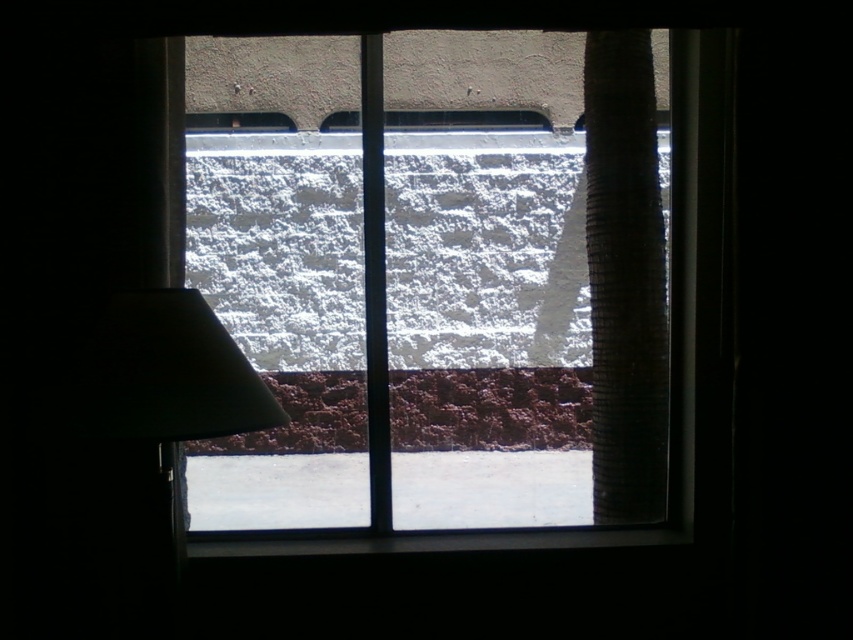
Does transparent glass window at center appear on the left side of white powdery snow at center?

No, transparent glass window at center is not to the left of white powdery snow at center.

Can you confirm if transparent glass window at center is taller than white powdery snow at center?

Yes.

The height and width of the screenshot is (640, 853). In order to click on transparent glass window at center in this screenshot , I will do `click(442, 333)`.

Identify the location of transparent glass window at center. (442, 333).

Between white powdery snow at center and black corrugated pipe at right, which one appears on the left side from the viewer's perspective?

From the viewer's perspective, white powdery snow at center appears more on the left side.

I want to click on white powdery snow at center, so click(x=485, y=252).

Where is `white powdery snow at center`? white powdery snow at center is located at coordinates (485, 252).

Can you confirm if transparent glass window at center is bigger than black corrugated pipe at right?

Correct, transparent glass window at center is larger in size than black corrugated pipe at right.

Consider the image. Which is more to the right, transparent glass window at center or black corrugated pipe at right?

From the viewer's perspective, black corrugated pipe at right appears more on the right side.

Who is more forward, (445, 179) or (621, 136)?

Point (621, 136) is more forward.

I want to click on transparent glass window at center, so click(442, 333).